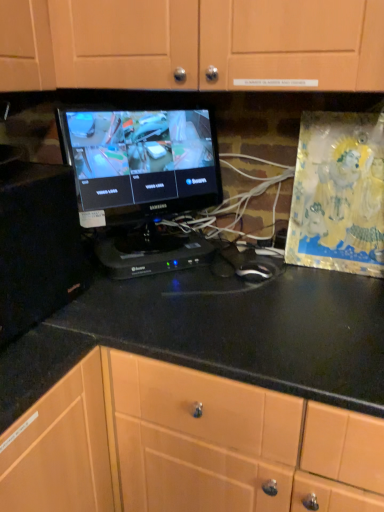
Question: Is point (354, 396) positioned closer to the camera than point (72, 258)?

Choices:
 (A) closer
 (B) farther

Answer: (A)

Question: Considering their positions, is black glossy countertop at center located in front of or behind black matte cabinet at left, the second cabinetry in the top-to-bottom sequence?

Choices:
 (A) front
 (B) behind

Answer: (A)

Question: Which object is the closest to the matte wood cabinet at upper center, which is the 2th cabinetry from left to right?

Choices:
 (A) black glossy monitor at center
 (B) black glossy countertop at center
 (C) black matte cabinet at left, which ranks as the first cabinetry in bottom-to-top order

Answer: (A)

Question: Based on their relative distances, which object is farther from the black glossy monitor at center?

Choices:
 (A) black glossy countertop at center
 (B) black matte cabinet at left, which ranks as the 1th cabinetry in left-to-right order
 (C) matte wood cabinet at upper center, the 1th cabinetry from the right

Answer: (A)